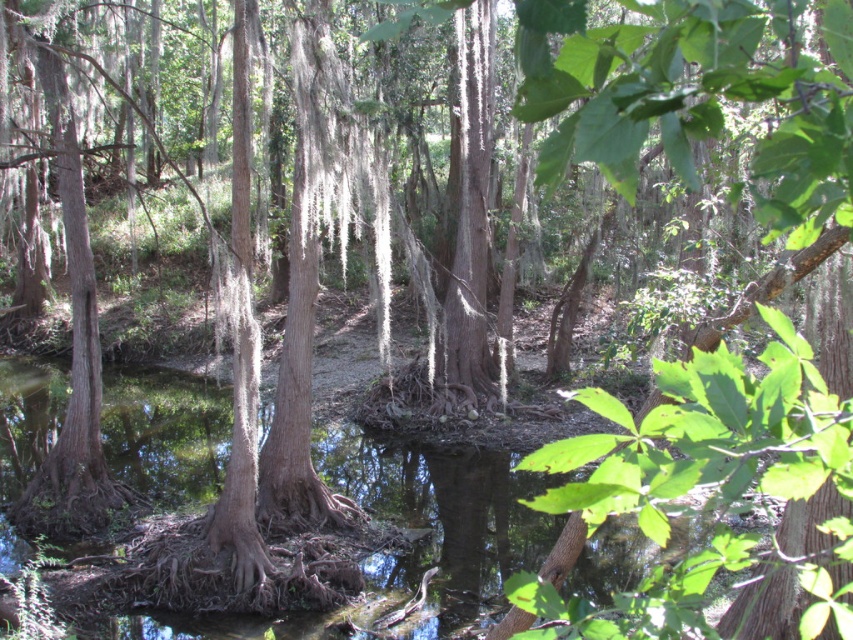
You are a hiker who wants to cross the swampy area. You see the clear water at center and the green leafy tree at center. How far apart are these two landmarks?

The distance between the clear water at center and the green leafy tree at center is 13.36 meters.

You are a photographer standing in the swampy forest scene. You want to capture a photo where the clear water at center and the green leafy tree at center are both visible. Which object will appear larger in the photo?

The clear water at center appears larger in the photo because it is taller than the green leafy tree at center.